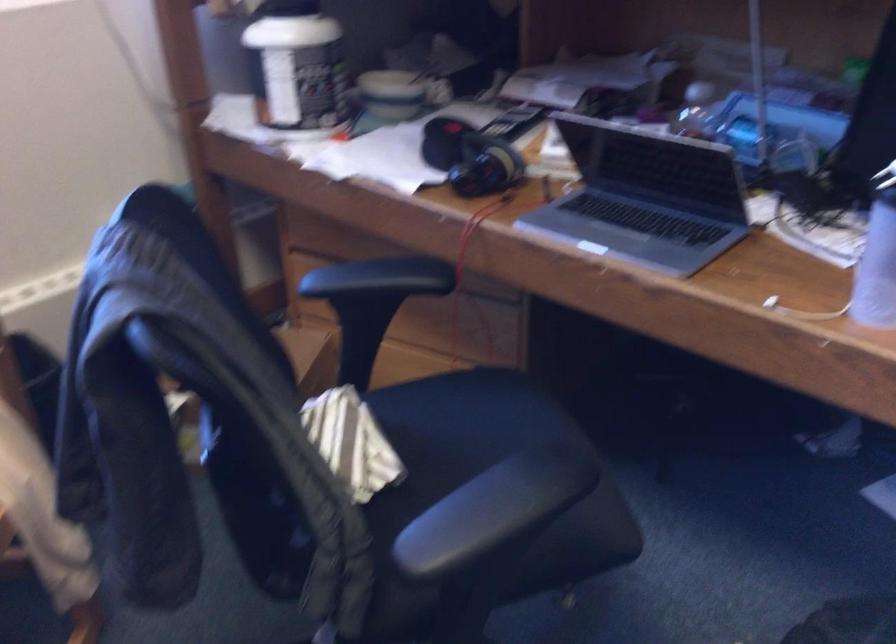
The height and width of the screenshot is (644, 896). What do you see at coordinates (461, 424) in the screenshot?
I see `the chair sitting surface` at bounding box center [461, 424].